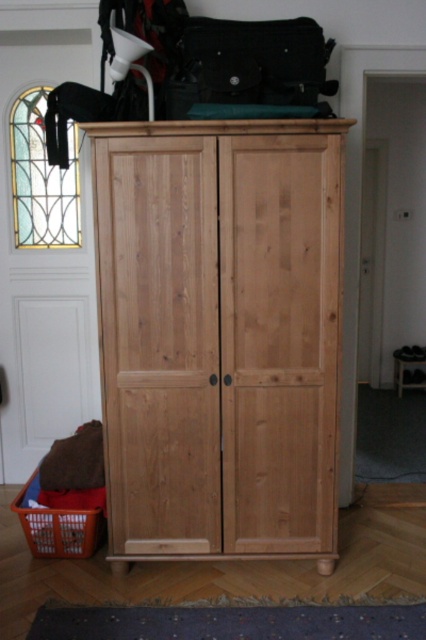
Question: Where is natural wood wardrobe at center located in relation to orange plastic basket at lower left in the image?

Choices:
 (A) right
 (B) left

Answer: (A)

Question: Among these points, which one is farthest from the camera?

Choices:
 (A) (69, 525)
 (B) (304, 67)
 (C) (330, 508)

Answer: (A)

Question: Is matte black bag at top to the right of orange plastic basket at lower left from the viewer's perspective?

Choices:
 (A) yes
 (B) no

Answer: (A)

Question: Which object appears closest to the camera in this image?

Choices:
 (A) orange plastic basket at lower left
 (B) natural wood wardrobe at center

Answer: (B)

Question: Is matte black bag at top closer to camera compared to orange plastic basket at lower left?

Choices:
 (A) no
 (B) yes

Answer: (B)

Question: Among these objects, which one is nearest to the camera?

Choices:
 (A) orange plastic basket at lower left
 (B) natural wood wardrobe at center
 (C) matte black bag at top

Answer: (B)